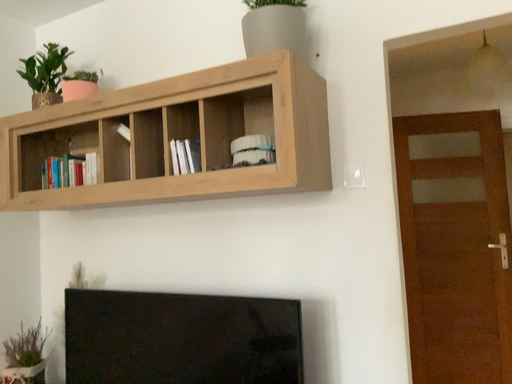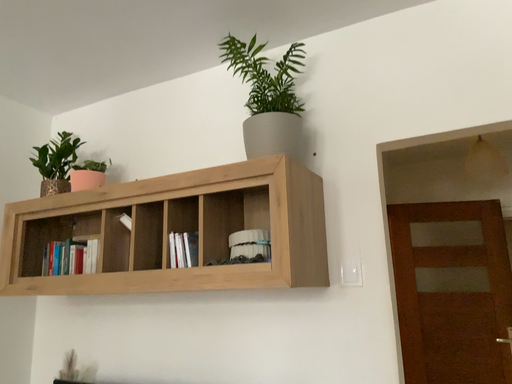
Question: Which way did the camera rotate in the video?

Choices:
 (A) rotated upward
 (B) rotated downward

Answer: (A)